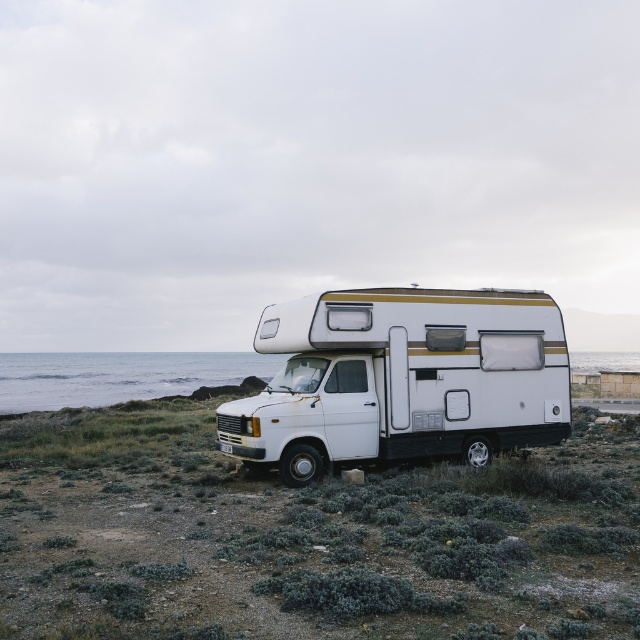
You are standing near the white camper van parked on the rugged terrain. There are two points marked on the ground near the van. The first point is at coordinate (358, 408) and the second is at (42, 396). Which of these two points is closer to you?

Point (358, 408) is closer to the viewer than point (42, 396).

You are planning to take a photo of the white matte recreational vehicle at center and the blue water at lower left. To ensure both are in frame, where should you position yourself relative to the van?

You should position yourself to the upper right of the white matte recreational vehicle at center so that the blue water at lower left is visible in the frame.